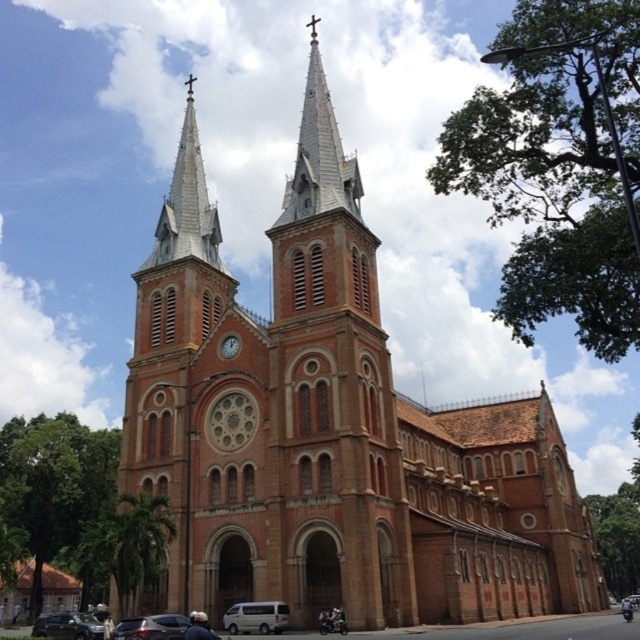
Question: Is metallic silver car at lower left closer to camera compared to matte brown clock at center?

Choices:
 (A) yes
 (B) no

Answer: (A)

Question: Does shiny black sedan at lower left come behind metallic silver car at lower left?

Choices:
 (A) no
 (B) yes

Answer: (B)

Question: Is the position of silver shingled spire at center more distant than that of white matte van at center?

Choices:
 (A) no
 (B) yes

Answer: (B)

Question: Which of the following is the farthest from the observer?

Choices:
 (A) (61, 620)
 (B) (129, 620)
 (C) (324, 620)
 (D) (248, 612)

Answer: (A)

Question: Considering the real-world distances, which object is farthest from the metallic silver car at lower left?

Choices:
 (A) shiny black sedan at lower left
 (B) matte brown clock at center
 (C) black matte motorcycle at lower center

Answer: (B)

Question: Which point is closer to the camera taking this photo?

Choices:
 (A) (627, 605)
 (B) (234, 349)
 (C) (326, 611)
 (D) (305, 154)

Answer: (C)